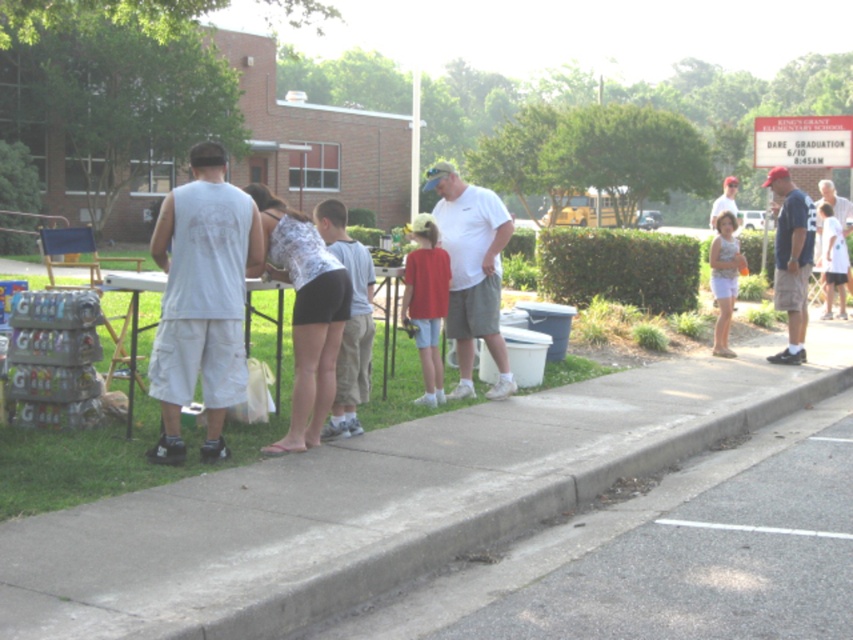
Question: Can you confirm if matte pink shirt at right is thinner than white asphalt at lower right?

Choices:
 (A) yes
 (B) no

Answer: (A)

Question: Which object appears farthest from the camera in this image?

Choices:
 (A) white cotton shirt at center
 (B) light brown shorts at center
 (C) dark blue t-shirt at right
 (D) white asphalt at lower right

Answer: (C)

Question: Is white cotton tank top at center wider than white matte t-shirt at center?

Choices:
 (A) no
 (B) yes

Answer: (B)

Question: Does white cotton shirt at center appear on the left side of white matte t-shirt at center?

Choices:
 (A) no
 (B) yes

Answer: (B)

Question: Estimate the real-world distances between objects in this image. Which object is farther from the white cotton shirt at upper right?

Choices:
 (A) red matte shirt at center
 (B) light brown shorts at center
 (C) matte pink shirt at right
 (D) white asphalt at lower right

Answer: (D)

Question: Which point is closer to the camera taking this photo?

Choices:
 (A) (368, 376)
 (B) (807, 275)
 (C) (260, 189)
 (D) (229, 362)

Answer: (D)